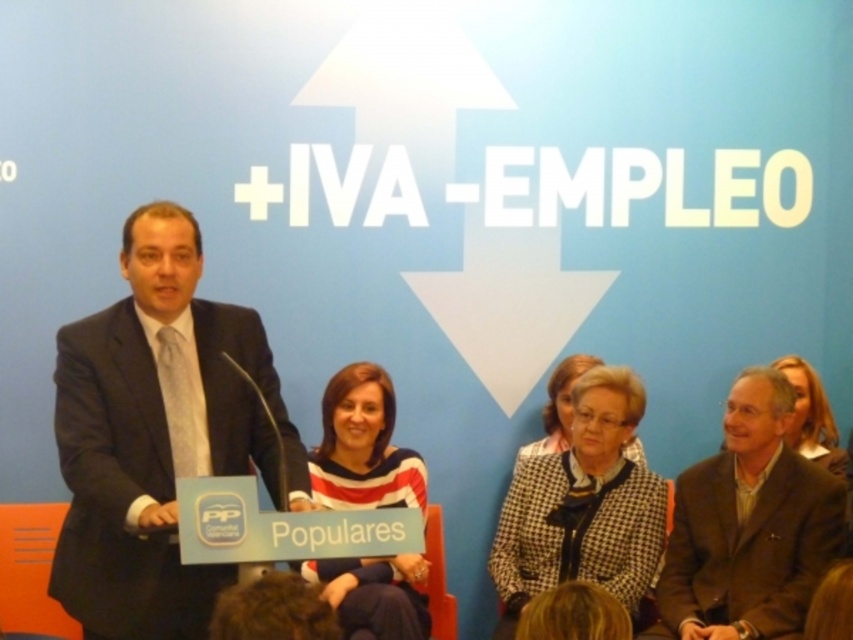
From the picture: You are a photographer at the event and want to capture a photo of the dark gray suit at left and the checkered fabric jacket at center without any obstruction. Which one should you focus on first to ensure it appears in the foreground?

The dark gray suit at left is in front of the checkered fabric jacket at center, so you should focus on the dark gray suit at left first to ensure it appears in the foreground.

You are a fashion designer observing the formal event. You notice two men in suits at the center of the scene. Which man is wearing a taller suit, the one in the brown woolen suit at center or the smooth beige blazer at center?

The brown woolen suit at center has a greater height compared to the smooth beige blazer at center, so the man in the brown woolen suit at center is wearing the taller suit.